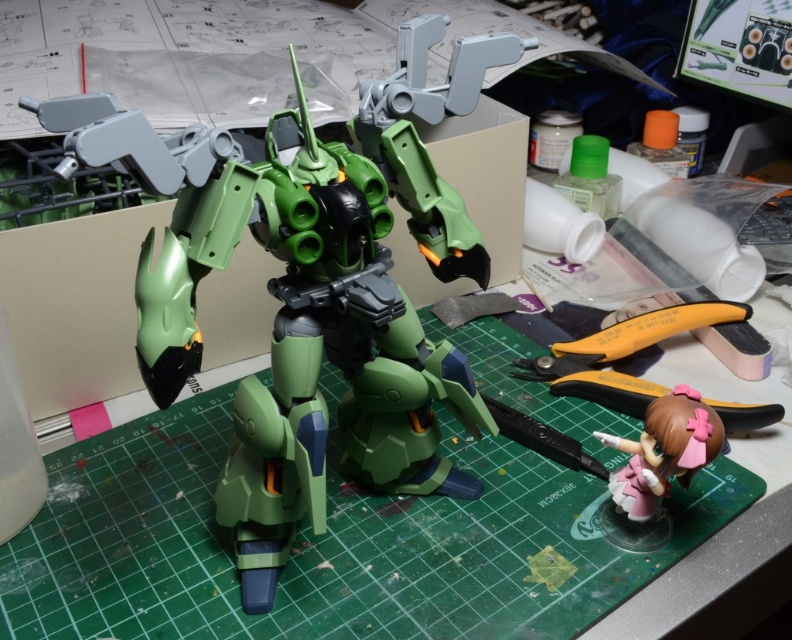
Question: Can you confirm if green plastic robot at center is positioned to the left of pink glossy figurine at lower right?

Choices:
 (A) no
 (B) yes

Answer: (B)

Question: Does green plastic robot at center appear on the right side of black plastic pliers at lower right?

Choices:
 (A) no
 (B) yes

Answer: (A)

Question: Which object appears farthest from the camera in this image?

Choices:
 (A) pink glossy figurine at lower right
 (B) black plastic pliers at lower right

Answer: (B)

Question: In this image, where is green plastic robot at center located relative to black plastic pliers at lower right?

Choices:
 (A) right
 (B) left

Answer: (B)

Question: Among these objects, which one is farthest from the camera?

Choices:
 (A) green plastic robot at center
 (B) black plastic pliers at lower right

Answer: (B)

Question: Among these points, which one is farthest from the camera?

Choices:
 (A) (596, 458)
 (B) (301, 179)

Answer: (A)